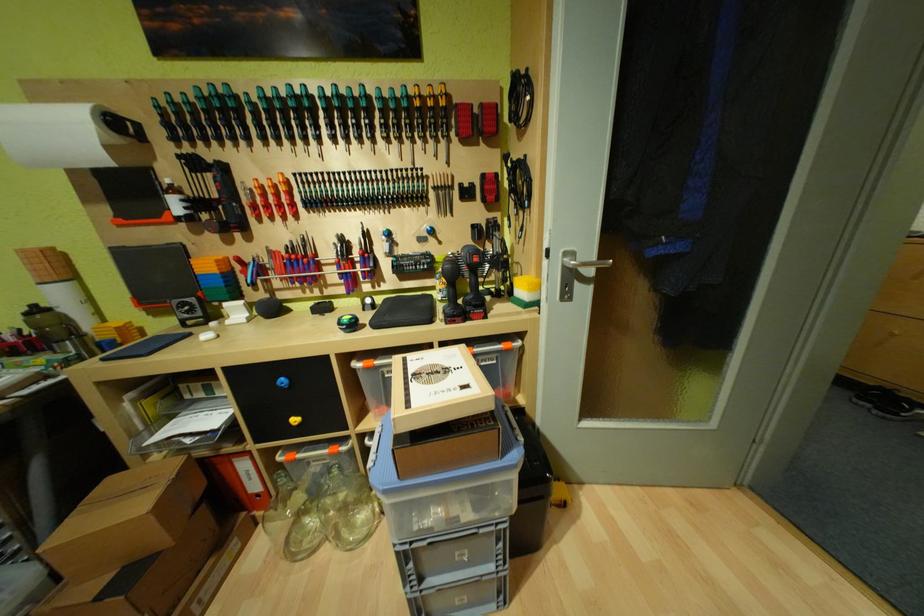
Where would you pull the silver door handle? Please return your answer as a coordinate pair (x, y).

(587, 264)